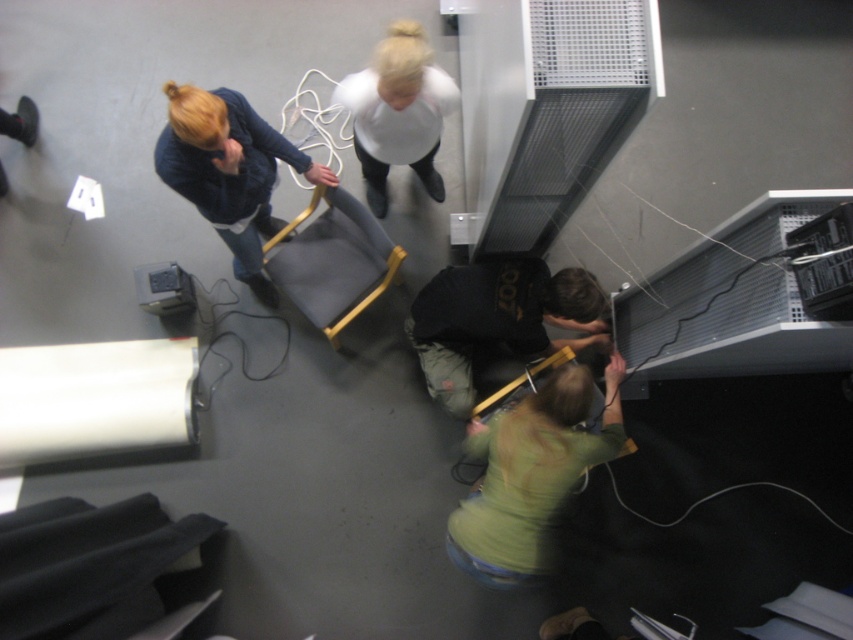
From the picture: You are a photographer taking a picture from above and want to ensure both the blonde hair at upper left and the metallic gray projector at lower left are in focus. Which object should you adjust your camera focus on first to account for their positions?

The metallic gray projector at lower left should be focused on first because the blonde hair at upper left is positioned to its right, meaning the projector is closer to the camera in this birdseye view.